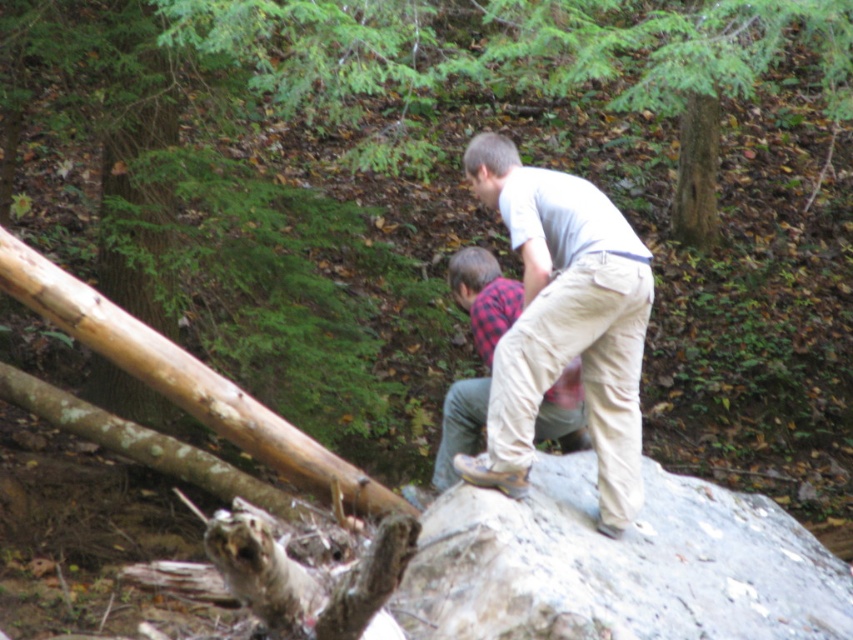
Question: Can you confirm if gray rough rock at center is smaller than light beige cotton pants at center?

Choices:
 (A) no
 (B) yes

Answer: (A)

Question: Which of these objects is positioned closest to the plaid fabric shirt at center?

Choices:
 (A) light beige cotton pants at center
 (B) gray rough rock at center

Answer: (A)

Question: Which point is farther to the camera?

Choices:
 (A) (564, 352)
 (B) (479, 269)

Answer: (B)

Question: Which object appears farthest from the camera in this image?

Choices:
 (A) light beige cotton pants at center
 (B) gray rough rock at center

Answer: (A)

Question: Does gray rough rock at center have a smaller size compared to plaid fabric shirt at center?

Choices:
 (A) no
 (B) yes

Answer: (A)

Question: Is light beige cotton pants at center thinner than plaid fabric shirt at center?

Choices:
 (A) no
 (B) yes

Answer: (A)